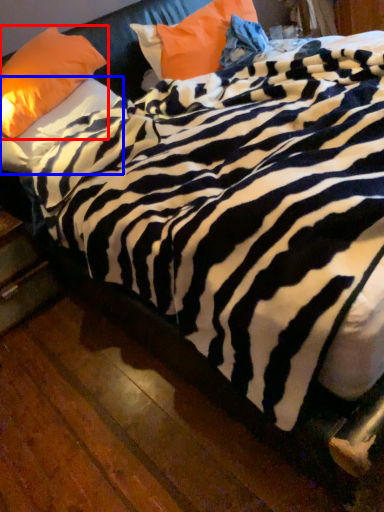
Question: Which of the following is the farthest to the observer, pillow (highlighted by a red box) or pillow (highlighted by a blue box)?

Choices:
 (A) pillow
 (B) pillow

Answer: (B)